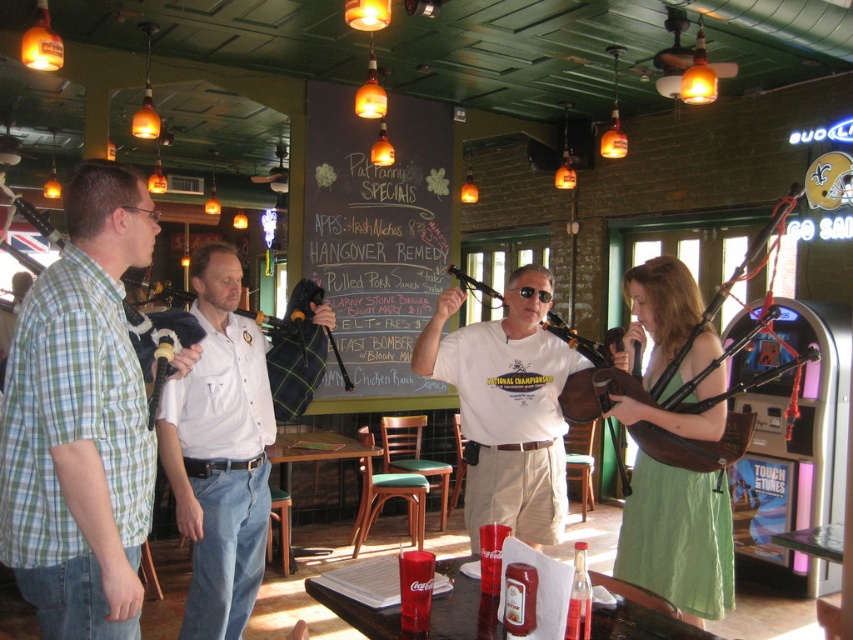
You are taking a photo of the two points in the pub scene. Which point, point (140,204) or point (506,362), will appear larger in your photo?

Point (140,204) will appear larger in the photo because it is closer to the camera than point (506,362).

What is the color of the shirt worn by the person located at the point with coordinates (80, 420)?

The green plaid shirt at left is represented by point (80, 420), so the shirt is green plaid.

You are a photographer standing in the pub and want to take a photo of both the white cotton shirt at center and the matte brown bagpipes at center. Which object should you focus on first to ensure both are in the frame?

You should focus on the white cotton shirt at center first because it is in front of the matte brown bagpipes at center, ensuring both will be captured in the frame.